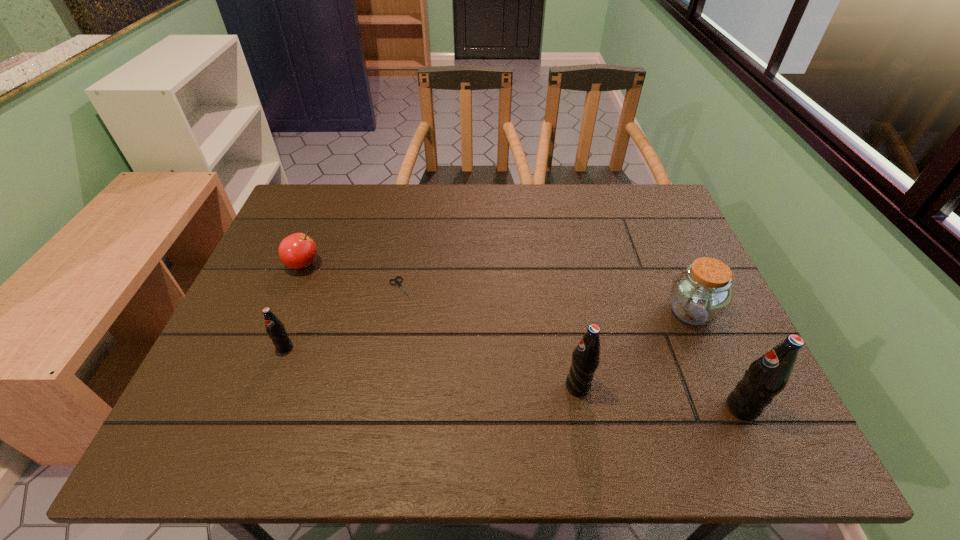
Identify which object is located as the third nearest to the shears. Please provide its 2D coordinates. Your answer should be formatted as a tuple, i.e. [(x, y)], where the tuple contains the x and y coordinates of a point satisfying the conditions above.

[(586, 356)]

The width and height of the screenshot is (960, 540). I want to click on object that is the third closest one to the jar, so click(398, 283).

Find the location of a particular element. the second closest pop to the second shortest object is located at coordinates (586, 356).

Find the location of a particular element. the second closest pop to the second shortest object is located at coordinates pyautogui.click(x=586, y=356).

Find the location of a particular element. vacant region that satisfies the following two spatial constraints: 1. on the front side of the second shortest object; 2. on the left side of the fourth object from right to left is located at coordinates (294, 289).

The height and width of the screenshot is (540, 960). I want to click on free space that satisfies the following two spatial constraints: 1. on the front side of the jar; 2. on the left side of the shears, so click(x=397, y=312).

Where is `vacant space that satisfies the following two spatial constraints: 1. on the front side of the shears; 2. on the left side of the apple`? Image resolution: width=960 pixels, height=540 pixels. vacant space that satisfies the following two spatial constraints: 1. on the front side of the shears; 2. on the left side of the apple is located at coordinates tap(294, 289).

You are a GUI agent. You are given a task and a screenshot of the screen. Output one action in this format:
    pyautogui.click(x=<x>, y=<y>)
    Task: Click on the vacant point that satisfies the following two spatial constraints: 1. on the front side of the jar; 2. on the front label of the second tallest object
    This screenshot has height=540, width=960.
    Given the screenshot: What is the action you would take?
    (x=724, y=386)